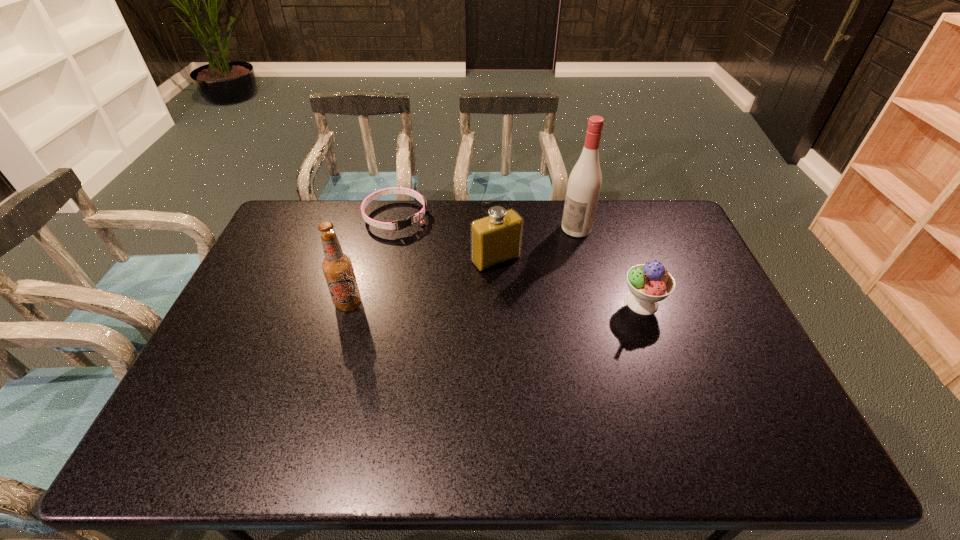
Where is `alcohol situated at the far edge`? The image size is (960, 540). alcohol situated at the far edge is located at coordinates (584, 184).

Locate an element on the screen. vacant space at the far edge of the desktop is located at coordinates (625, 222).

Locate an element on the screen. The height and width of the screenshot is (540, 960). free spot at the left edge of the desktop is located at coordinates (249, 285).

Where is `free space at the right edge of the desktop`? The image size is (960, 540). free space at the right edge of the desktop is located at coordinates (694, 308).

Locate an element on the screen. Image resolution: width=960 pixels, height=540 pixels. blank space at the far left corner of the desktop is located at coordinates point(313,234).

Locate an element on the screen. This screenshot has height=540, width=960. blank space at the near left corner of the desktop is located at coordinates (184, 401).

Find the location of `vacant space that is in between the shortest object and the second tallest object`. vacant space that is in between the shortest object and the second tallest object is located at coordinates (372, 260).

Image resolution: width=960 pixels, height=540 pixels. What are the coordinates of `free space between the alcohol and the second tallest object` in the screenshot? It's located at (463, 266).

In order to click on vacant space that's between the fourth shortest object and the shortest object in this screenshot , I will do `click(372, 260)`.

This screenshot has width=960, height=540. I want to click on empty space that is in between the dog collar and the icecream, so click(519, 260).